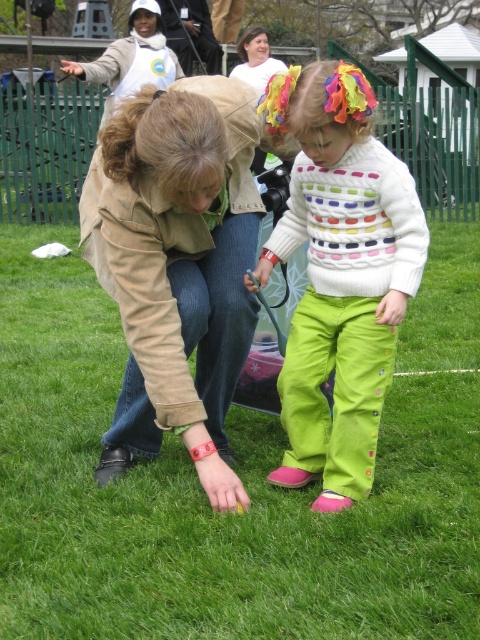
Question: Which of the following is the closest to the observer?

Choices:
 (A) (259, 92)
 (B) (325, 360)

Answer: (B)

Question: Does white knitted sweater at center have a greater width compared to matte beige jacket at center?

Choices:
 (A) no
 (B) yes

Answer: (B)

Question: Can you confirm if tan leather jacket at center is positioned below matte beige jacket at center?

Choices:
 (A) yes
 (B) no

Answer: (A)

Question: Is white cotton shirt at upper center bigger than matte beige jacket at center?

Choices:
 (A) no
 (B) yes

Answer: (B)

Question: Which object is farther from the camera taking this photo?

Choices:
 (A) white knitted sweater at center
 (B) green grass at center

Answer: (A)

Question: Estimate the real-world distances between objects in this image. Which object is farther from the white knitted sweater at center?

Choices:
 (A) tan leather jacket at center
 (B) white cotton shirt at upper center
 (C) green grass at center
 (D) matte beige jacket at center

Answer: (D)